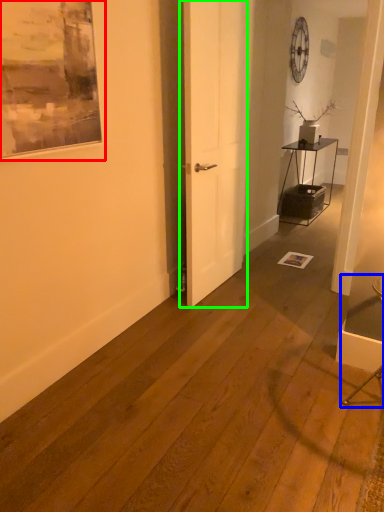
Question: Which object is the closest to the picture frame (highlighted by a red box)? Choose among these: armchair (highlighted by a blue box) or door (highlighted by a green box).

Choices:
 (A) armchair
 (B) door

Answer: (B)